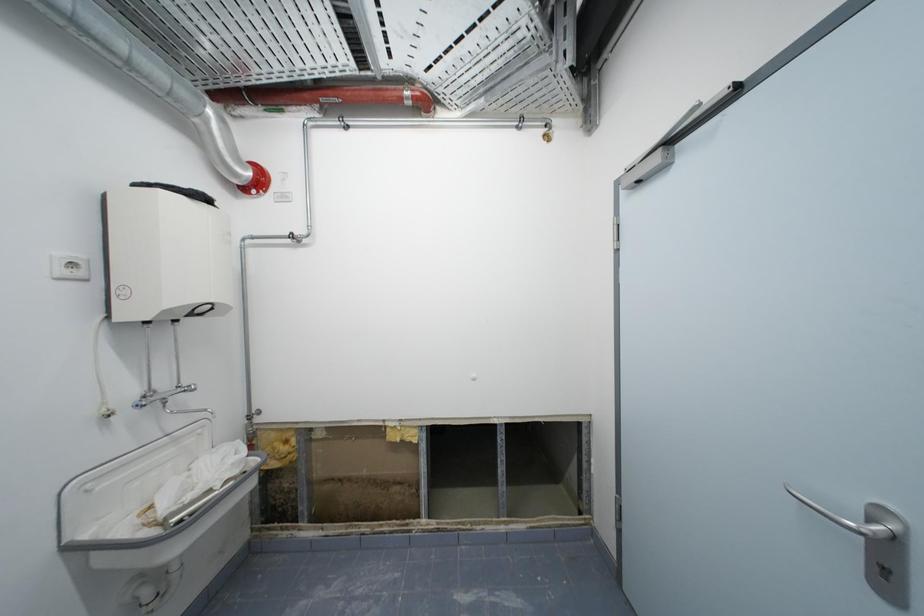
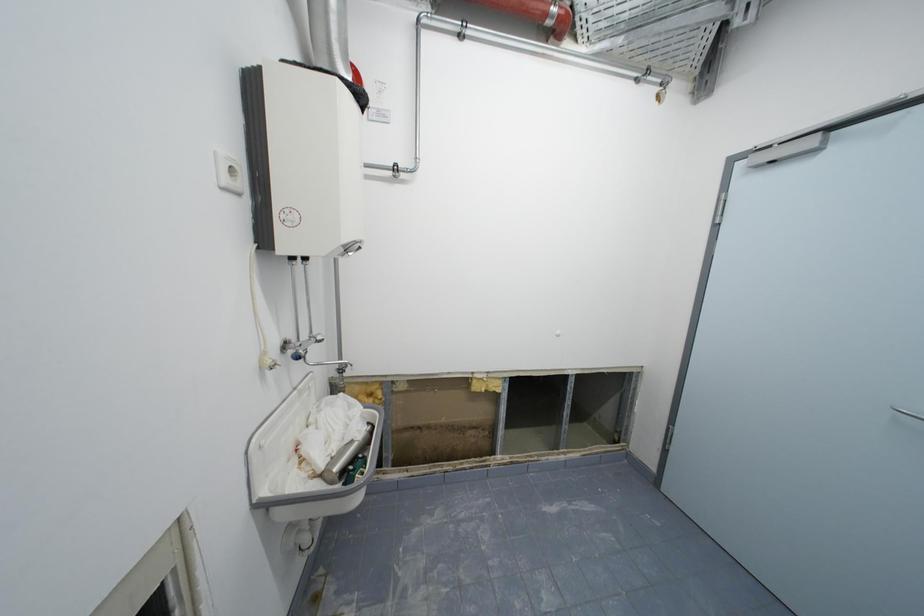
Question: Based on the continuous images, in which direction is the camera rotating? Reply with the corresponding letter.

Choices:
 (A) Left
 (B) Right
 (C) Up
 (D) Down

Answer: (B)